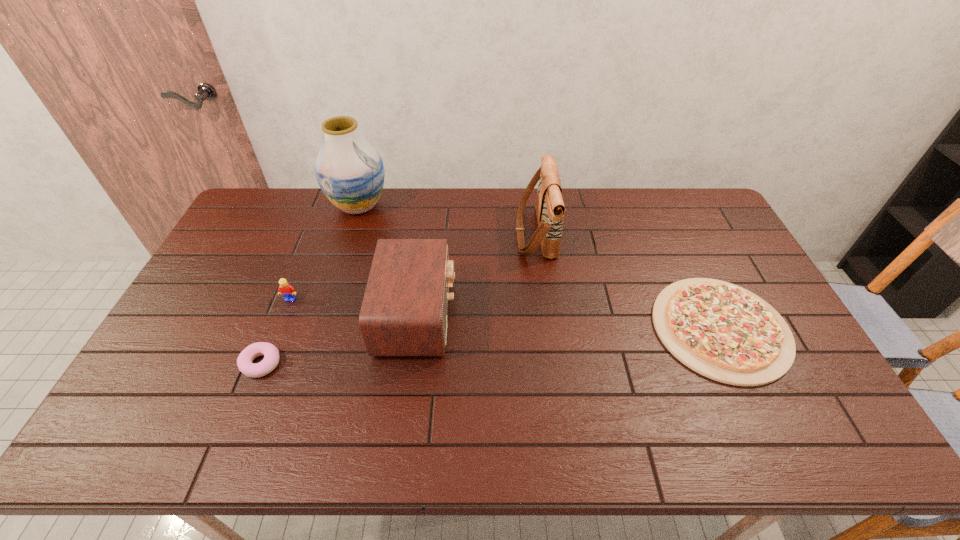
In order to click on the tallest object in this screenshot , I will do click(x=350, y=172).

You are a GUI agent. You are given a task and a screenshot of the screen. Output one action in this format:
    pyautogui.click(x=<x>, y=<y>)
    Task: Click on the fifth shortest object
    The image size is (960, 540).
    Given the screenshot: What is the action you would take?
    pyautogui.click(x=549, y=205)

The height and width of the screenshot is (540, 960). What are the coordinates of `shoulder bag` in the screenshot? It's located at (549, 205).

This screenshot has height=540, width=960. I want to click on radio receiver, so click(404, 311).

Identify the location of the third object from right to left. The image size is (960, 540). (404, 311).

At what (x,y) coordinates should I click in order to perform the action: click on the fourth tallest object. Please return your answer as a coordinate pair (x, y). The width and height of the screenshot is (960, 540). Looking at the image, I should click on (285, 289).

This screenshot has width=960, height=540. I want to click on pastry, so click(271, 354).

Locate an element on the screen. The height and width of the screenshot is (540, 960). the shortest object is located at coordinates (722, 331).

This screenshot has width=960, height=540. In order to click on the rightmost object in this screenshot , I will do `click(722, 331)`.

Image resolution: width=960 pixels, height=540 pixels. In order to click on free space located 0.260m on the left of the tallest object in this screenshot , I will do `click(257, 206)`.